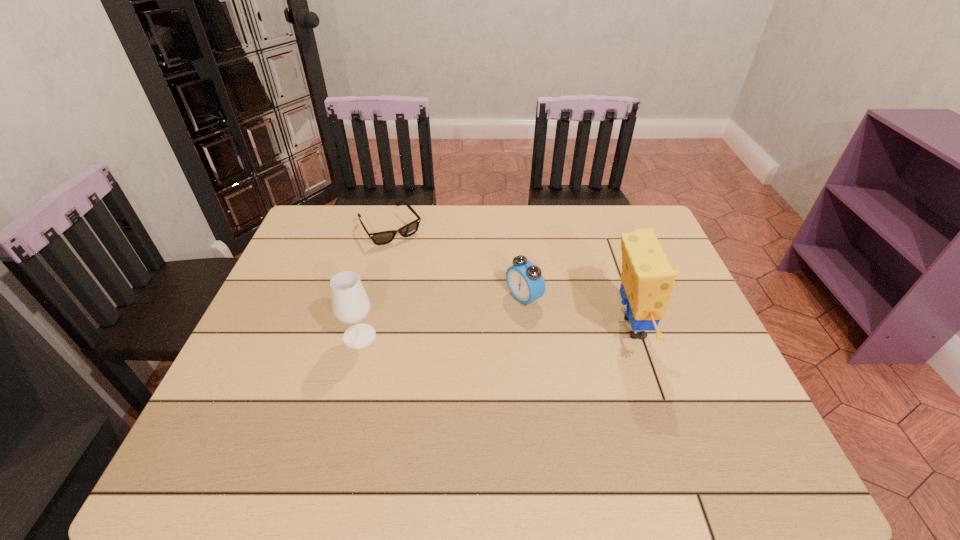
Image resolution: width=960 pixels, height=540 pixels. Find the location of `free space on the desktop that is between the glass and the rightmost object and is positioned on the front-facing side of the farthest object`. free space on the desktop that is between the glass and the rightmost object and is positioned on the front-facing side of the farthest object is located at coordinates (468, 333).

At what (x,y) coordinates should I click in order to perform the action: click on vacant space on the desktop that is between the glass and the rightmost object and is positioned on the face of the third tallest object. Please return your answer as a coordinate pair (x, y). Image resolution: width=960 pixels, height=540 pixels. Looking at the image, I should click on (457, 333).